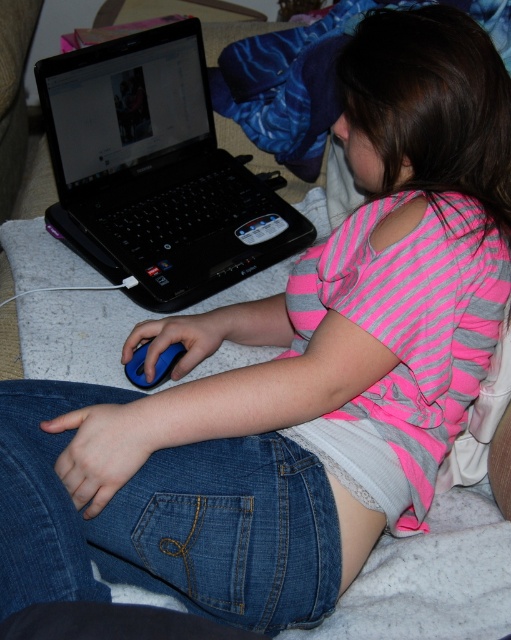
The denim at lower center is located at point (x=168, y=520). Based on the coordinates, where exactly is the denim at lower center positioned?

The denim at lower center is positioned at coordinates point (x=168, y=520).

The denim at lower center is located at what coordinates?

The denim at lower center is located at point (x=168, y=520).

You are a delivery person trying to place a small package between the black plastic laptop at upper left and the blue rubber mouse at lower left. Can you fit it there?

The black plastic laptop at upper left is positioned over the blue rubber mouse at lower left, meaning there is no space between them for the package to fit.